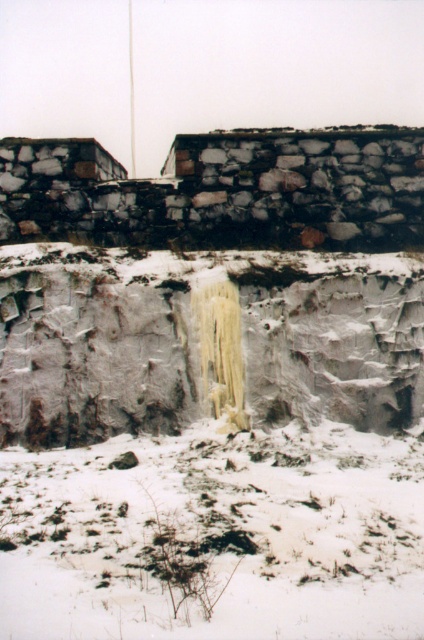
Based on the photo, you are standing at the base of the large stone wall in the snowy landscape. You notice a point marked at coordinates [215,536]. What is located at this point?

The point at coordinates [215,536] corresponds to white powdery snow at lower center.

You are an explorer trying to cross the area between the white powdery snow at lower center and the rough stone wall at upper center. Considering the thickness of the snow, will you sink into the snow or stay on top?

The white powdery snow at lower center is thinner than the rough stone wall at upper center. Since the snow is thinner, you will likely sink into the white powdery snow at lower center when crossing it.